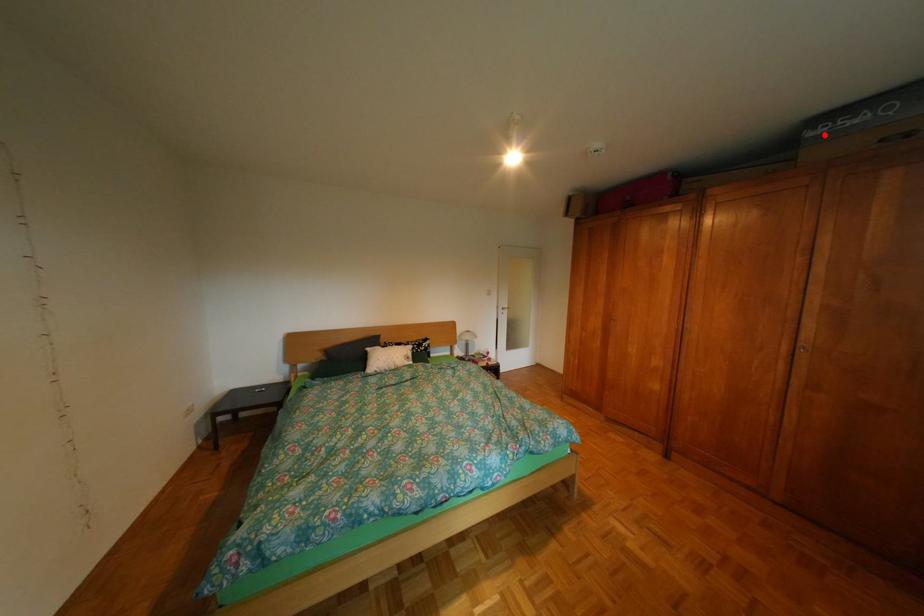
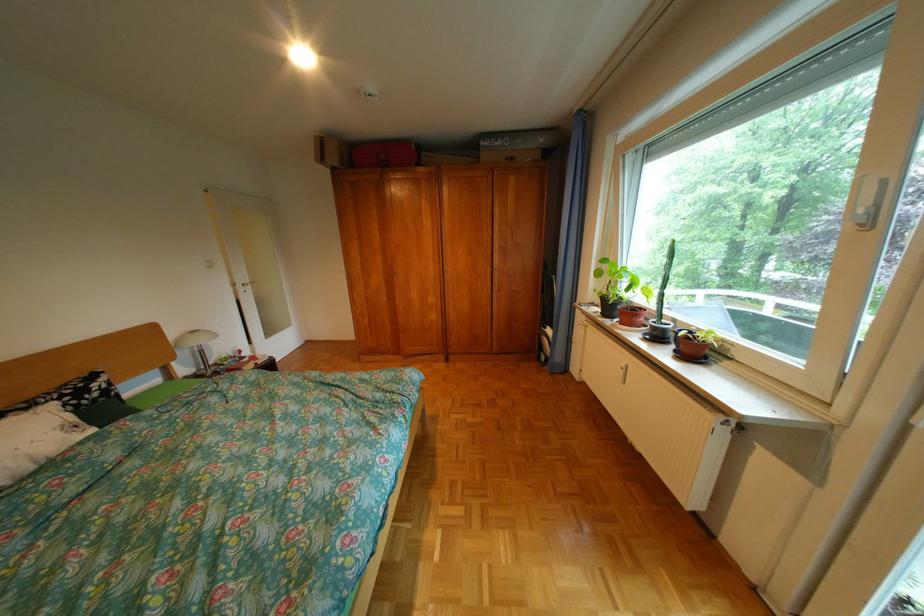
Question: I am providing you with two images of the same scene from different viewpoints. Image1 has a red point marked. In image2, the corresponding 3D location appears at what relative position? Reply with the corresponding letter.

Choices:
 (A) Closer
 (B) Farther

Answer: (A)